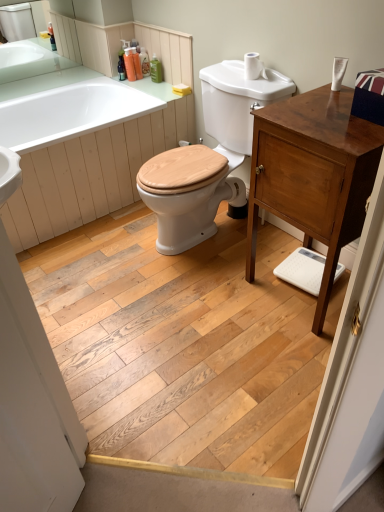
Where is `vacant region to the left of green matte bottle at upper center, placed as the first toiletry when sorted from right to left`? This screenshot has height=512, width=384. vacant region to the left of green matte bottle at upper center, placed as the first toiletry when sorted from right to left is located at coordinates (144, 81).